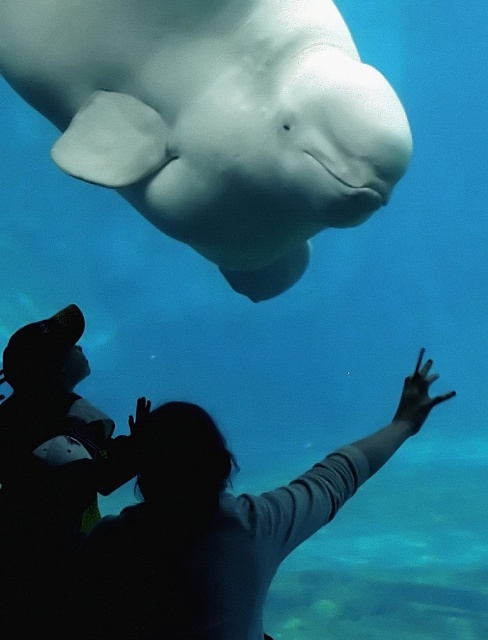
You are a marine biologist observing the underwater scene. You need to determine which object is larger between the white smooth whale at upper center and the silhouette fabric at center. Based on the scene, which one is bigger?

The white smooth whale at upper center is bigger than the silhouette fabric at center.

You are a marine biologist observing the underwater scene. You notice the white smooth whale at upper center and the silhouette fabric at center. Which object is located to the right of the other?

The silhouette fabric at center is located to the right of the white smooth whale at upper center.